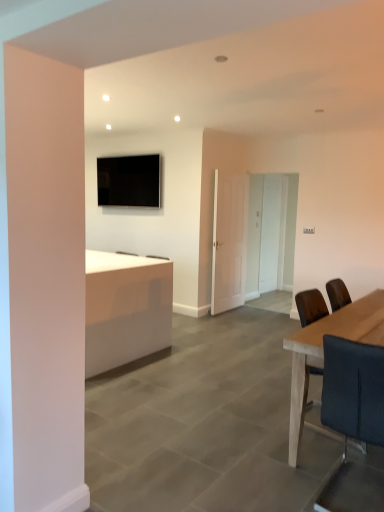
Question: Does white matte door at center have a lesser height compared to light brown wooden table at right?

Choices:
 (A) no
 (B) yes

Answer: (A)

Question: Is white matte door at center directly adjacent to light brown wooden table at right?

Choices:
 (A) no
 (B) yes

Answer: (A)

Question: Is white matte door at center smaller than light brown wooden table at right?

Choices:
 (A) no
 (B) yes

Answer: (B)

Question: Considering the relative sizes of white matte door at center and light brown wooden table at right in the image provided, is white matte door at center bigger than light brown wooden table at right?

Choices:
 (A) yes
 (B) no

Answer: (B)

Question: Would you say white matte door at center contains light brown wooden table at right?

Choices:
 (A) no
 (B) yes

Answer: (A)

Question: Would you say white matte door at center is outside light brown wooden table at right?

Choices:
 (A) yes
 (B) no

Answer: (A)

Question: Is light brown wooden table at right far from matte black tv at upper center?

Choices:
 (A) no
 (B) yes

Answer: (B)

Question: Considering the relative sizes of light brown wooden table at right and matte black tv at upper center in the image provided, is light brown wooden table at right thinner than matte black tv at upper center?

Choices:
 (A) no
 (B) yes

Answer: (A)

Question: Can you confirm if light brown wooden table at right is taller than matte black tv at upper center?

Choices:
 (A) no
 (B) yes

Answer: (B)

Question: Is the position of light brown wooden table at right less distant than that of matte black tv at upper center?

Choices:
 (A) yes
 (B) no

Answer: (A)

Question: Is light brown wooden table at right turned away from matte black tv at upper center?

Choices:
 (A) yes
 (B) no

Answer: (B)

Question: Can matte black tv at upper center be found inside light brown wooden table at right?

Choices:
 (A) yes
 (B) no

Answer: (B)

Question: Is light brown wooden table at right to the right of white matte door at center from the viewer's perspective?

Choices:
 (A) no
 (B) yes

Answer: (B)